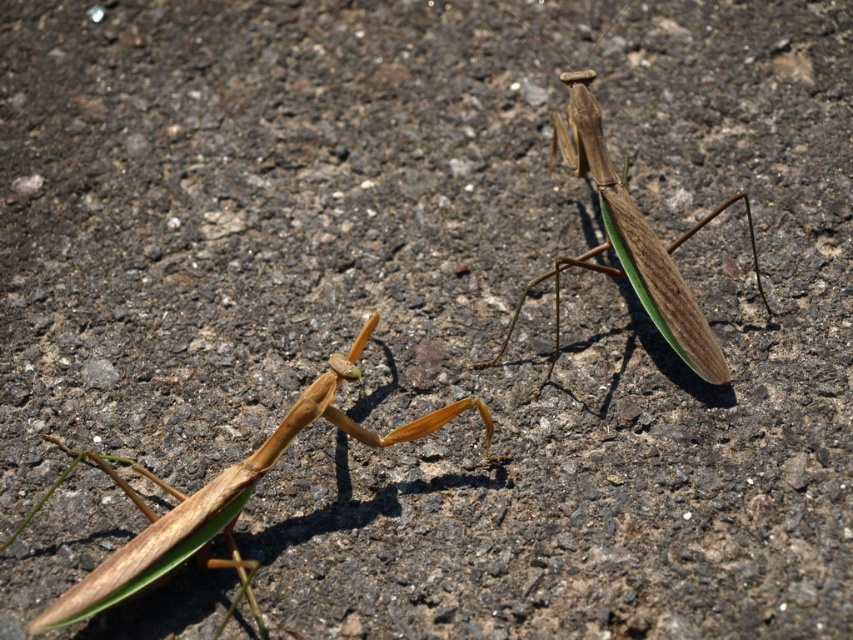
You are standing at a distance and looking at the point marked as point (234, 477). Can you reach this point with your outstretched hand without moving your feet?

The point (234, 477) is 3.89 feet away from you, so you cannot reach it with your outstretched hand since the average human arm length is about 2.5 feet.